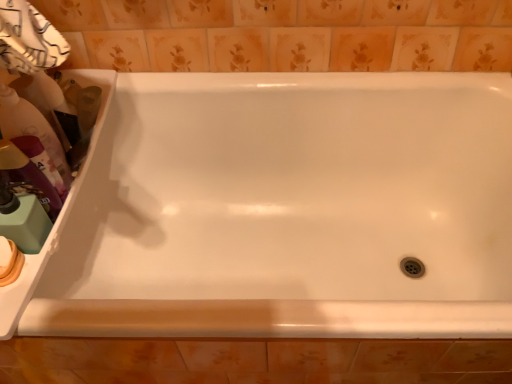
Question: Does point (0, 256) appear closer or farther from the camera than point (42, 205)?

Choices:
 (A) farther
 (B) closer

Answer: (B)

Question: From the image's perspective, is beige matte soap at lower left located above or below matte purple bottle at left, acting as the 3th cleaning product starting from the top?

Choices:
 (A) below
 (B) above

Answer: (A)

Question: Which object is the closest to the white glossy bathtub at center?

Choices:
 (A) matte plastic bottle at left, positioned as the 4th cleaning product in bottom-to-top order
 (B) matte purple bottle at left, acting as the 3th cleaning product starting from the top
 (C) beige matte soap at lower left
 (D) white glossy sink at left
 (E) matte plastic bottle at left, positioned as the third cleaning product in bottom-to-top order

Answer: (D)

Question: Which object is the farthest from the matte plastic bottle at left, positioned as the third cleaning product in bottom-to-top order?

Choices:
 (A) white glossy sink at left
 (B) beige matte soap at lower left
 (C) matte purple bottle at left, acting as the 3th cleaning product starting from the top
 (D) matte plastic bottle at left, which ranks as the 1th cleaning product in top-to-bottom order
 (E) matte green pump at left, acting as the 1th cleaning product starting from the bottom

Answer: (B)